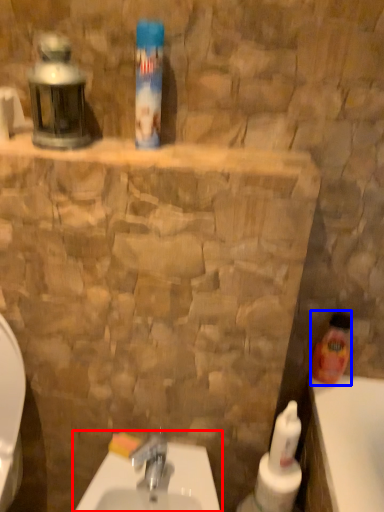
Question: Which object is further to the camera taking this photo, sink (highlighted by a red box) or cleaning product (highlighted by a blue box)?

Choices:
 (A) sink
 (B) cleaning product

Answer: (B)